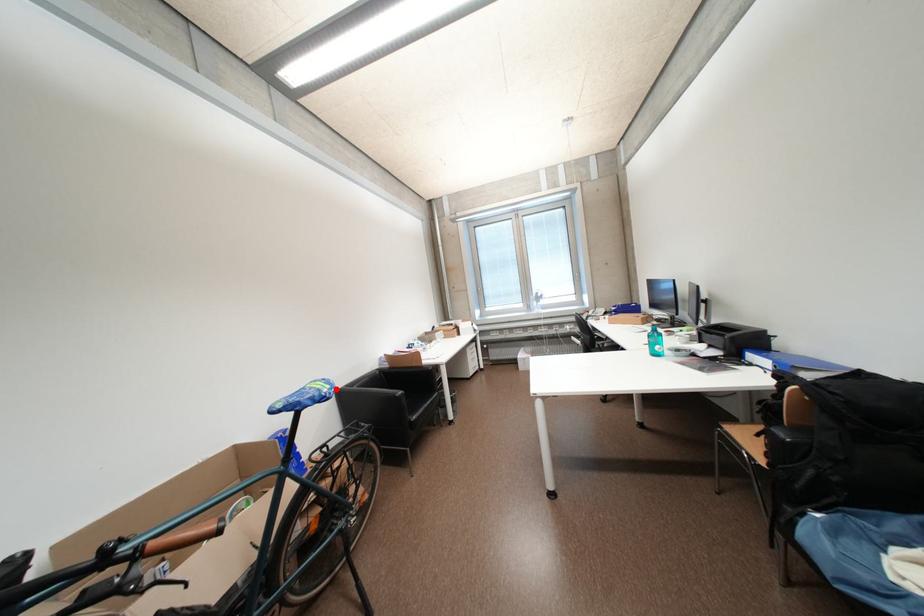
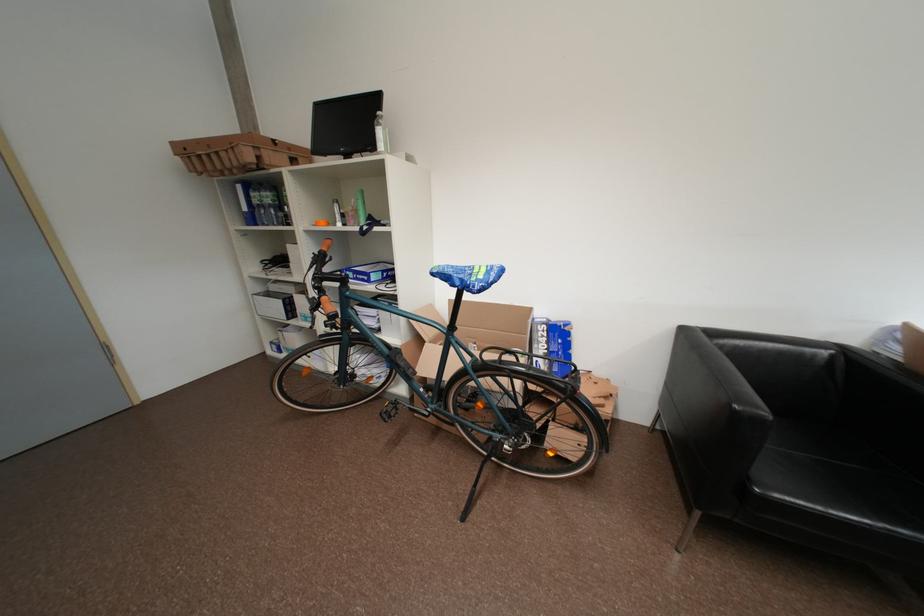
Question: I am providing you with two images of the same scene from different viewpoints. In image1, a red point is highlighted. Considering the same 3D point in image2, which of the following is correct?

Choices:
 (A) It is closer
 (B) It is farther

Answer: (B)